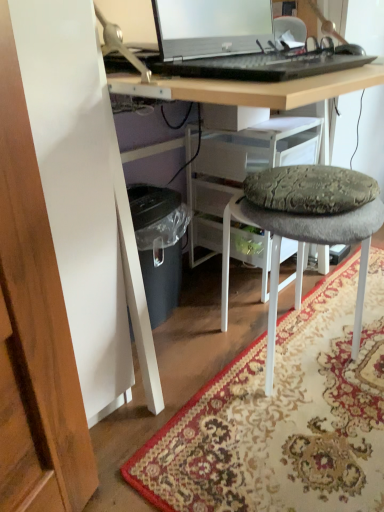
At what (x,y) coordinates should I click in order to perform the action: click on vacant point above patterned carpet at lower center (from a real-world perspective). Please return your answer as a coordinate pair (x, y). The height and width of the screenshot is (512, 384). Looking at the image, I should click on (310, 375).